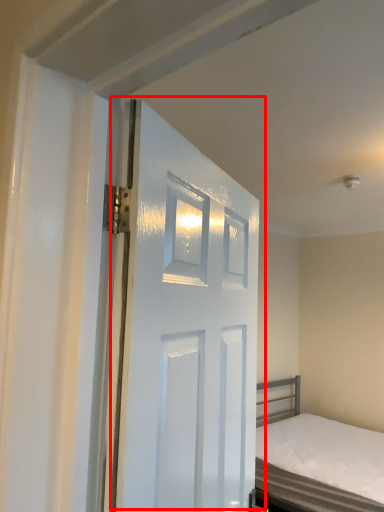
Question: From the image's perspective, where is door (annotated by the red box) located relative to bed?

Choices:
 (A) above
 (B) below

Answer: (A)